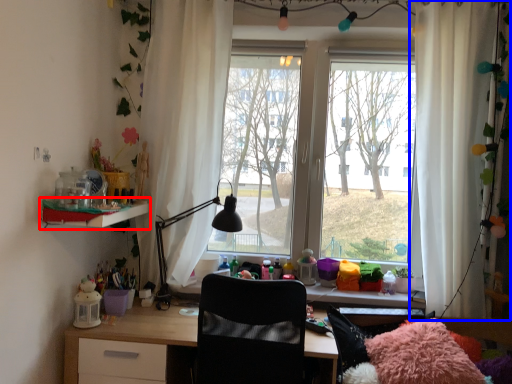
Question: Which object appears closest to the camera in this image, shelf (highlighted by a red box) or curtain (highlighted by a blue box)?

Choices:
 (A) shelf
 (B) curtain

Answer: (A)